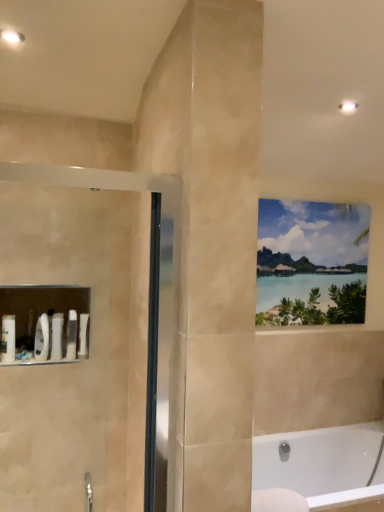
Question: Should I look upward or downward to see white glossy bathtub at lower right?

Choices:
 (A) down
 (B) up

Answer: (A)

Question: Can you confirm if white glossy bathtub at lower right is taller than watercolor painting at upper right?

Choices:
 (A) no
 (B) yes

Answer: (A)

Question: Is white glossy bathtub at lower right oriented towards watercolor painting at upper right?

Choices:
 (A) no
 (B) yes

Answer: (A)

Question: Is white glossy bathtub at lower right turned away from watercolor painting at upper right?

Choices:
 (A) no
 (B) yes

Answer: (A)

Question: From the image's perspective, would you say white glossy bathtub at lower right is positioned over watercolor painting at upper right?

Choices:
 (A) yes
 (B) no

Answer: (B)

Question: From a real-world perspective, does white glossy bathtub at lower right sit lower than watercolor painting at upper right?

Choices:
 (A) yes
 (B) no

Answer: (A)

Question: Is white glossy bathtub at lower right at the left side of watercolor painting at upper right?

Choices:
 (A) no
 (B) yes

Answer: (A)

Question: Can you confirm if watercolor painting at upper right is bigger than white glossy bathtub at lower right?

Choices:
 (A) yes
 (B) no

Answer: (B)

Question: Is watercolor painting at upper right wider than white glossy bathtub at lower right?

Choices:
 (A) no
 (B) yes

Answer: (A)

Question: Is watercolor painting at upper right positioned beyond the bounds of white glossy bathtub at lower right?

Choices:
 (A) yes
 (B) no

Answer: (A)

Question: Is watercolor painting at upper right to the right of white glossy bathtub at lower right from the viewer's perspective?

Choices:
 (A) no
 (B) yes

Answer: (A)

Question: Is watercolor painting at upper right smaller than white glossy bathtub at lower right?

Choices:
 (A) yes
 (B) no

Answer: (A)

Question: Is watercolor painting at upper right far away from white glossy bathtub at lower right?

Choices:
 (A) no
 (B) yes

Answer: (B)

Question: In terms of height, does watercolor painting at upper right look taller or shorter compared to white glossy bathtub at lower right?

Choices:
 (A) short
 (B) tall

Answer: (B)